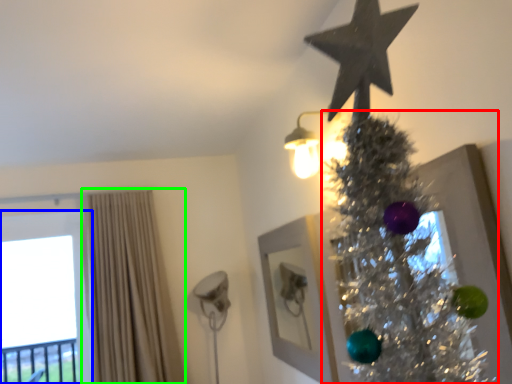
Question: Considering the real-world distances, which object is closest to christmas tree (highlighted by a red box)? window (highlighted by a blue box) or curtain (highlighted by a green box).

Choices:
 (A) window
 (B) curtain

Answer: (B)